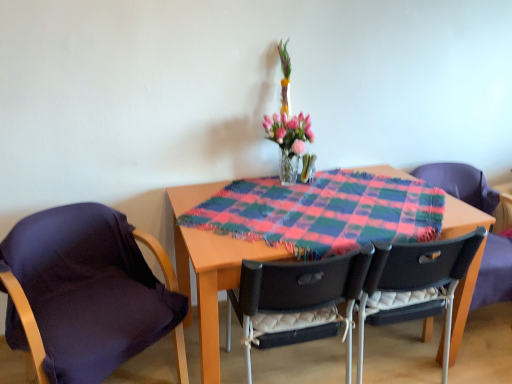
Question: From a real-world perspective, is dark purple fabric at left, the 4th chair positioned from the right, above or below translucent glass vase at center?

Choices:
 (A) above
 (B) below

Answer: (B)

Question: Looking at their shapes, would you say dark purple fabric at left, acting as the 1th chair starting from the left, is wider or thinner than translucent glass vase at center?

Choices:
 (A) wide
 (B) thin

Answer: (A)

Question: Based on their relative distances, which object is nearer to the plaid fabric at center?

Choices:
 (A) dark purple fabric at left, acting as the 1th chair starting from the left
 (B) translucent glass vase at center
 (C) black plastic chair at center, the 3th chair when ordered from left to right
 (D) matte black chair at right, which appears as the 1th chair when viewed from the right
 (E) black plastic chair at center, which appears as the second chair when viewed from the left

Answer: (E)

Question: Based on their relative distances, which object is nearer to the black plastic chair at center, which appears as the second chair when viewed from the left?

Choices:
 (A) matte black chair at right, the fourth chair from the left
 (B) dark purple fabric at left, the 4th chair positioned from the right
 (C) black plastic chair at center, marked as the 2th chair in a right-to-left arrangement
 (D) plaid fabric at center
 (E) translucent glass vase at center

Answer: (C)